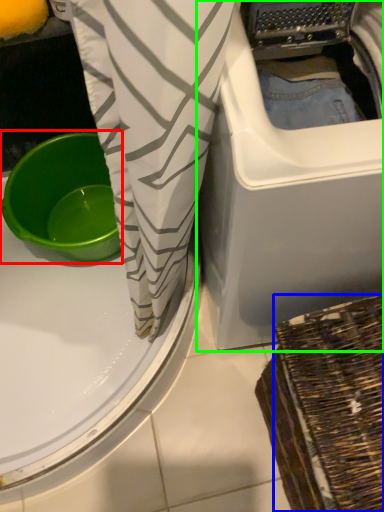
Question: Based on their relative distances, which object is farther from basin (highlighted by a red box)? Choose from basket (highlighted by a blue box) and washing machine (highlighted by a green box).

Choices:
 (A) basket
 (B) washing machine

Answer: (A)